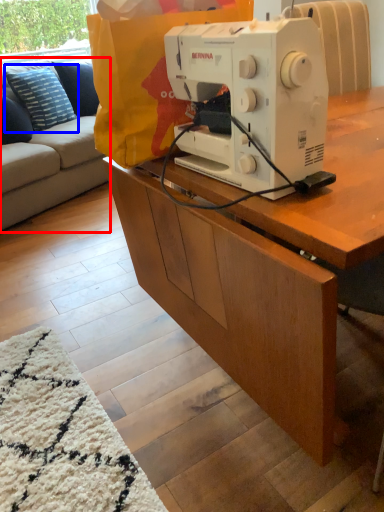
Question: Which object appears farthest to the camera in this image, studio couch (highlighted by a red box) or pillow (highlighted by a blue box)?

Choices:
 (A) studio couch
 (B) pillow

Answer: (B)